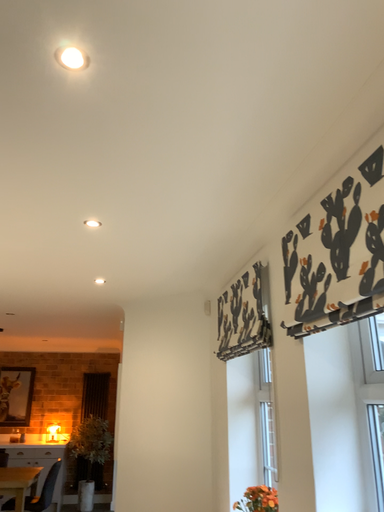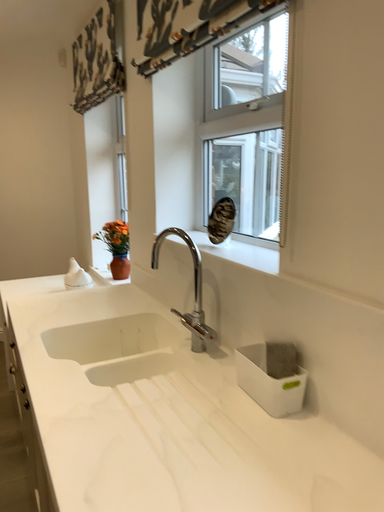
Question: Which way did the camera rotate in the video?

Choices:
 (A) rotated upward
 (B) rotated downward

Answer: (B)